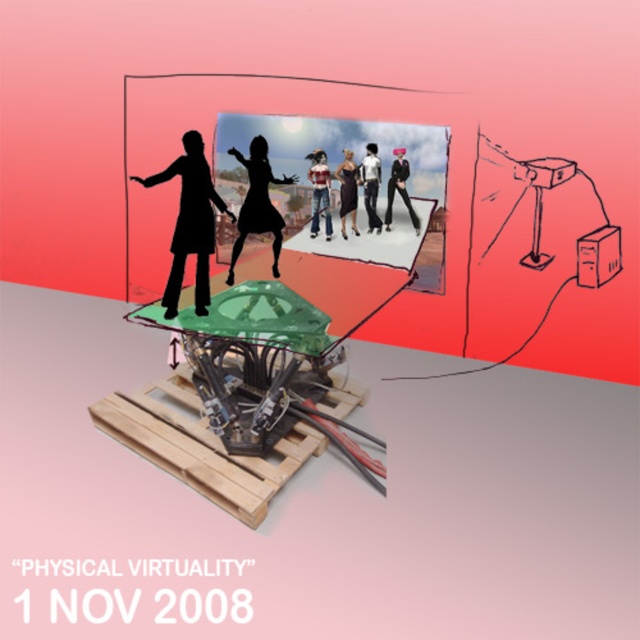
Is black matte figure at center wider than denim jeans at center?

Yes.

The height and width of the screenshot is (640, 640). I want to click on black matte figure at center, so 189,221.

Between black matte figure at center and black matte dress at center, which one has less height?

With less height is black matte figure at center.

Identify the location of black matte figure at center. This screenshot has width=640, height=640. (189, 221).

I want to click on black matte dress at center, so click(x=257, y=204).

Does black matte dress at center appear on the left side of matte black shirt at center?

Correct, you'll find black matte dress at center to the left of matte black shirt at center.

Which is in front, point (268, 228) or point (378, 228)?

Point (268, 228)

At what (x,y) coordinates should I click in order to perform the action: click on black matte dress at center. Please return your answer as a coordinate pair (x, y). Image resolution: width=640 pixels, height=640 pixels. Looking at the image, I should click on (257, 204).